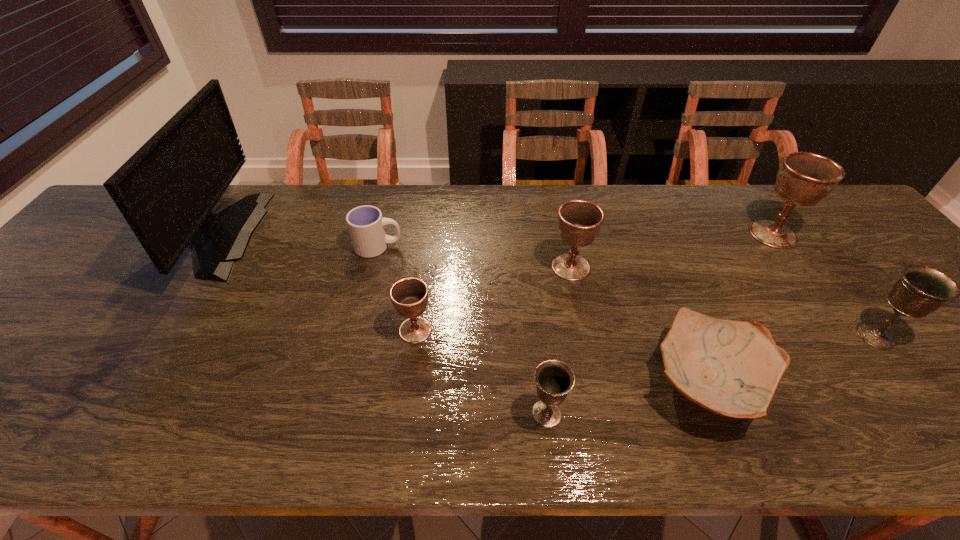
Where is `vacant space located 0.300m with the handle on the side of the seventh object from right to left`? vacant space located 0.300m with the handle on the side of the seventh object from right to left is located at coordinates (511, 247).

What are the coordinates of `free space located 0.090m on the back of the third object from right to left` in the screenshot? It's located at (674, 302).

Where is `monitor that is at the far edge`? The height and width of the screenshot is (540, 960). monitor that is at the far edge is located at coordinates [166, 190].

Locate an element on the screen. This screenshot has width=960, height=540. chalice that is positioned at the far edge is located at coordinates (804, 179).

What are the coordinates of `chalice at the near edge` in the screenshot? It's located at (554, 379).

You are a GUI agent. You are given a task and a screenshot of the screen. Output one action in this format:
    pyautogui.click(x=<x>, y=<y>)
    Task: Click on the pottery that is at the near edge
    The height and width of the screenshot is (540, 960).
    Given the screenshot: What is the action you would take?
    pyautogui.click(x=732, y=368)

Identify the location of object that is positioned at the right edge. This screenshot has height=540, width=960. (921, 290).

In the image, there is a desktop. Where is `free space at the far edge`? The width and height of the screenshot is (960, 540). free space at the far edge is located at coordinates (627, 222).

Identify the location of vacant region at the near edge of the desktop. (946, 448).

Where is `free space at the right edge of the desktop`? free space at the right edge of the desktop is located at coordinates (853, 256).